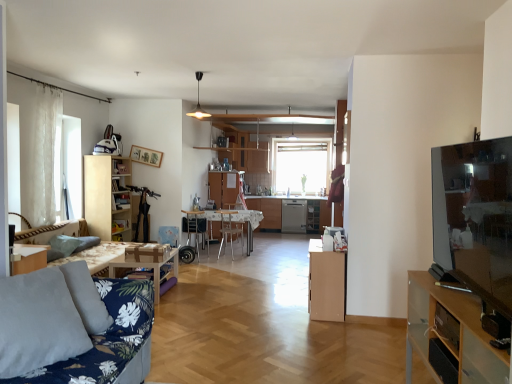
This screenshot has width=512, height=384. Identify the location of free location in front of light brown wood cabinet at center, the second cabinetry viewed from the back. (346, 327).